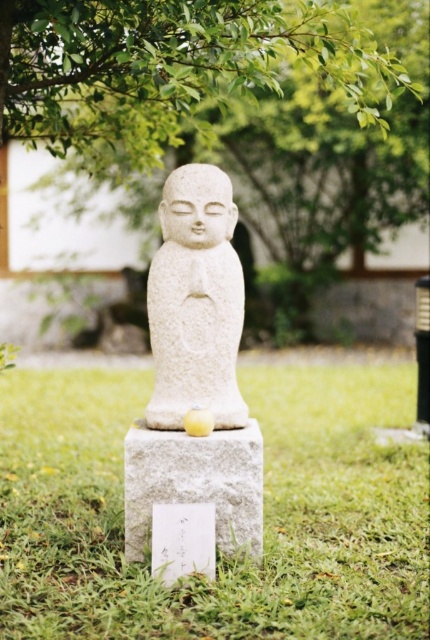
Does green leafy tree at upper center have a greater width compared to white stone statue at center?

Yes.

What do you see at coordinates (168, 65) in the screenshot?
I see `green leafy tree at upper center` at bounding box center [168, 65].

Find the location of `green leafy tree at upper center`. green leafy tree at upper center is located at coordinates (168, 65).

I want to click on green leafy tree at upper center, so click(x=168, y=65).

Is green grass at center taller than green leafy tree at upper center?

Indeed, green grass at center has a greater height compared to green leafy tree at upper center.

Is green grass at center to the right of green leafy tree at upper center from the viewer's perspective?

Correct, you'll find green grass at center to the right of green leafy tree at upper center.

Who is more forward, [350,554] or [86,76]?

Point [350,554]

Locate an element on the screen. The image size is (430, 640). green grass at center is located at coordinates (218, 557).

Does green grass at center appear on the right side of white stone statue at center?

Correct, you'll find green grass at center to the right of white stone statue at center.

Does green grass at center have a smaller size compared to white stone statue at center?

Actually, green grass at center might be larger than white stone statue at center.

This screenshot has width=430, height=640. What are the coordinates of `green grass at center` in the screenshot? It's located at (218, 557).

Where is `green grass at center`? The image size is (430, 640). green grass at center is located at coordinates (218, 557).